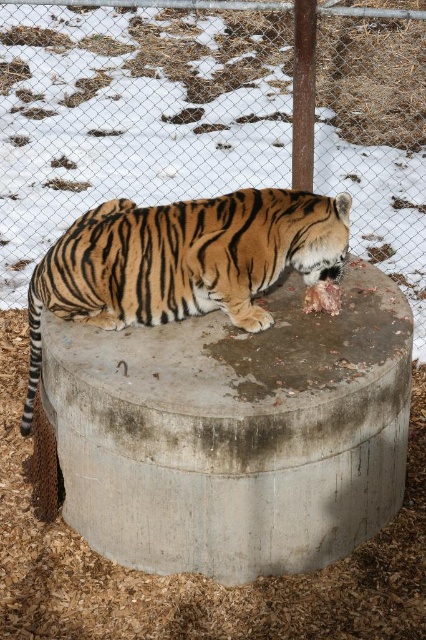
Question: Which point appears closest to the camera in this image?

Choices:
 (A) (224, 484)
 (B) (423, 198)

Answer: (A)

Question: Which of the following is the closest to the observer?

Choices:
 (A) gray concrete at center
 (B) orange-brown striped tiger at center

Answer: (A)

Question: Which is nearer to the metal mesh fence at upper center?

Choices:
 (A) gray concrete at center
 (B) orange-brown striped tiger at center

Answer: (A)

Question: Is metal mesh fence at upper center wider than gray concrete at center?

Choices:
 (A) yes
 (B) no

Answer: (A)

Question: Does gray concrete at center have a greater width compared to orange-brown striped tiger at center?

Choices:
 (A) yes
 (B) no

Answer: (A)

Question: Can you confirm if metal mesh fence at upper center is positioned above gray concrete at center?

Choices:
 (A) yes
 (B) no

Answer: (A)